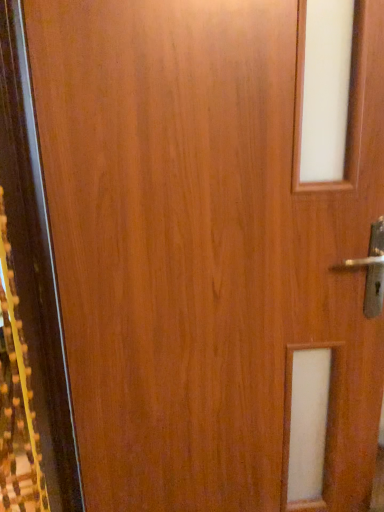
What do you see at coordinates (17, 399) in the screenshot? This screenshot has width=384, height=512. I see `yellow textured curtain at left` at bounding box center [17, 399].

Locate an element on the screen. The height and width of the screenshot is (512, 384). yellow textured curtain at left is located at coordinates (17, 399).

Measure the distance between yellow textured curtain at left and camera.

yellow textured curtain at left and camera are 37.31 inches apart.

Find the location of a particular element. Image resolution: width=384 pixels, height=512 pixels. yellow textured curtain at left is located at coordinates tap(17, 399).